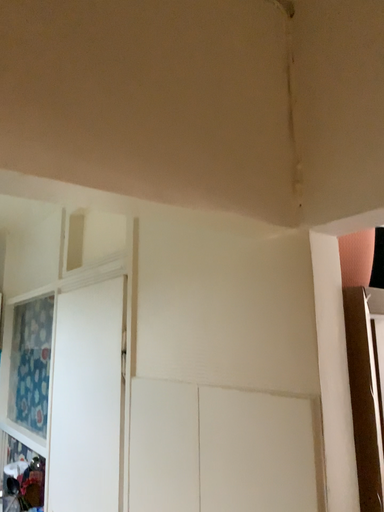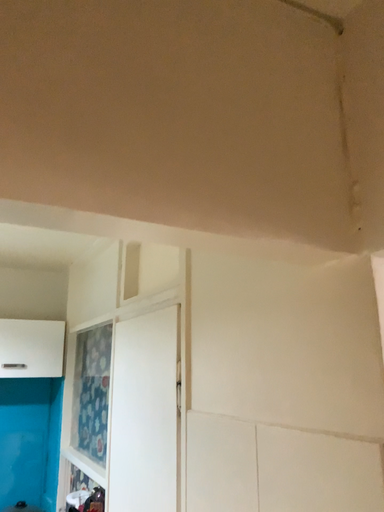
Question: How did the camera likely rotate when shooting the video?

Choices:
 (A) rotated left
 (B) rotated right

Answer: (A)